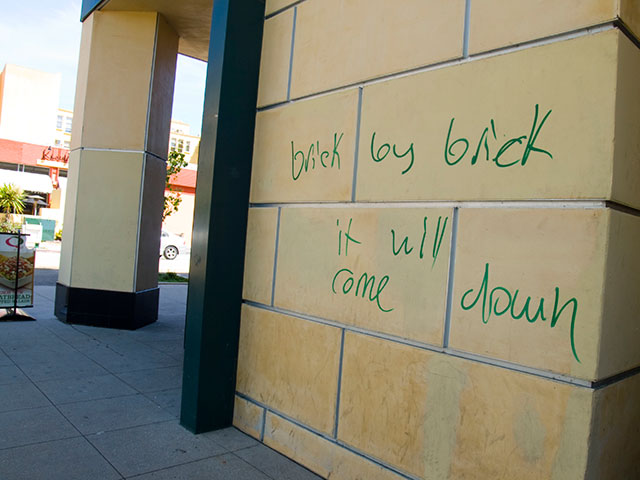
Identify the location of wall. (388, 85).